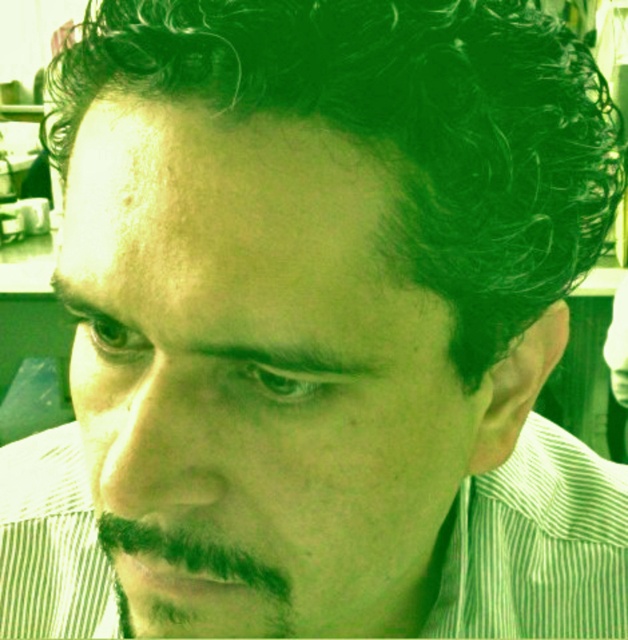
Question: Is dark curly hair at upper center closer to the viewer compared to dark brown fuzzy beard at lower left?

Choices:
 (A) yes
 (B) no

Answer: (A)

Question: Observing the image, what is the correct spatial positioning of dark curly hair at upper center in reference to dark brown fuzzy beard at lower left?

Choices:
 (A) right
 (B) left

Answer: (B)

Question: Among these objects, which one is nearest to the camera?

Choices:
 (A) dark brown fuzzy beard at lower left
 (B) dark curly hair at upper center

Answer: (B)

Question: Which point is closer to the camera?

Choices:
 (A) (111, 554)
 (B) (116, 76)

Answer: (B)

Question: Is dark curly hair at upper center below dark brown fuzzy beard at lower left?

Choices:
 (A) yes
 (B) no

Answer: (B)